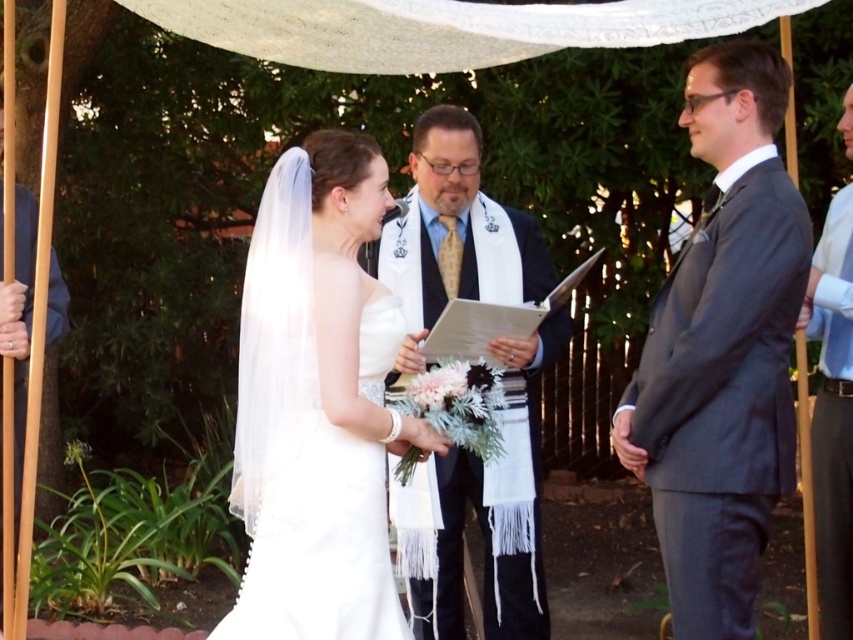
Between gray suit at right and white satin dress at left, which one appears on the left side from the viewer's perspective?

white satin dress at left

Based on the photo, is gray suit at right to the left of white satin dress at left from the viewer's perspective?

Incorrect, gray suit at right is not on the left side of white satin dress at left.

Between point (767, 397) and point (50, 282), which one is positioned behind?

Point (50, 282)

Locate an element on the screen. The image size is (853, 640). gray suit at right is located at coordinates (722, 349).

In the scene shown: Is white satin dress at center taller than white satin dress at left?

No, white satin dress at center is not taller than white satin dress at left.

You are a GUI agent. You are given a task and a screenshot of the screen. Output one action in this format:
    pyautogui.click(x=<x>, y=<y>)
    Task: Click on the white satin dress at center
    The height and width of the screenshot is (640, 853).
    Given the screenshot: What is the action you would take?
    pyautogui.click(x=317, y=403)

Measure the distance between white satin dress at center and camera.

A distance of 3.18 meters exists between white satin dress at center and camera.

I want to click on white satin dress at center, so click(x=317, y=403).

Between white textured scarf at center and light blue shirt at right, which one appears on the left side from the viewer's perspective?

From the viewer's perspective, white textured scarf at center appears more on the left side.

Does white textured scarf at center have a lesser width compared to light blue shirt at right?

No.

I want to click on white textured scarf at center, so click(x=482, y=515).

Image resolution: width=853 pixels, height=640 pixels. Find the location of `white textured scarf at center`. white textured scarf at center is located at coordinates (482, 515).